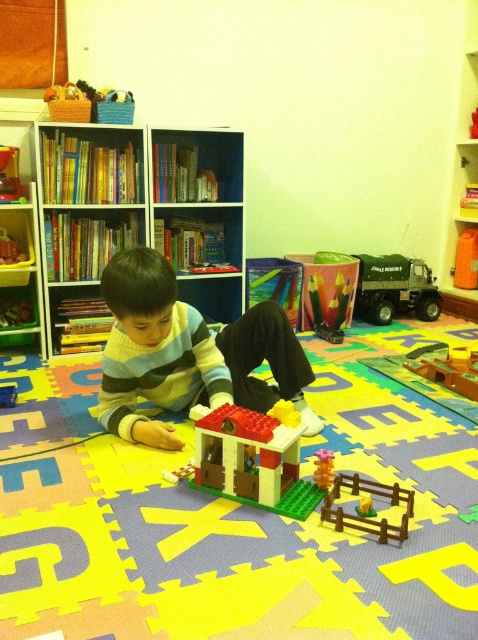
You are a GUI agent. You are given a task and a screenshot of the screen. Output one action in this format:
    pyautogui.click(x=<x>, y=<y>)
    Task: Click on the brick-like plastic house at center
    The image size is (478, 640).
    Given the screenshot: What is the action you would take?
    click(250, 460)

Between brick-like plastic house at center and yellow plastic toy at center, which one is positioned higher?

yellow plastic toy at center is higher up.

Which is in front, point (251, 461) or point (10, 257)?

Point (251, 461)

Identify the location of brick-like plastic house at center. (250, 460).

Is wooden bookshelf at upper left further to the viewer compared to smooth plastic toy at center?

No.

How distant is wooden bookshelf at upper left from smooth plastic toy at center?

25.06 inches

Where is `wooden bookshelf at upper left`? The width and height of the screenshot is (478, 640). wooden bookshelf at upper left is located at coordinates (139, 218).

Does yellow plastic toy at center appear on the right side of matte plastic toy at center?

In fact, yellow plastic toy at center is to the left of matte plastic toy at center.

Does yellow plastic toy at center have a lesser height compared to matte plastic toy at center?

No.

Is point (21, 256) closer to viewer compared to point (7, 387)?

No, (21, 256) is behind (7, 387).

Identify the location of yellow plastic toy at center. (10, 250).